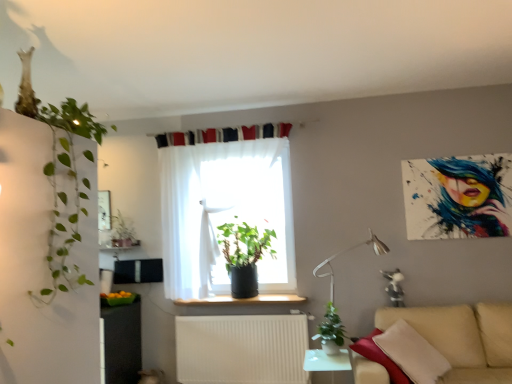
Question: Is green matte plant at lower center, which appears as the 2th houseplant when viewed from the front, inside or outside of white glossy table at lower center?

Choices:
 (A) outside
 (B) inside

Answer: (A)

Question: Looking at their shapes, would you say green matte plant at lower center, the 4th houseplant positioned from the left, is wider or thinner than white glossy table at lower center?

Choices:
 (A) wide
 (B) thin

Answer: (B)

Question: Considering the real-world distances, which object is farthest from the white glossy table at lower center?

Choices:
 (A) beige fabric couch at lower right
 (B) black plastic window sill at center
 (C) white matte radiator at lower center
 (D) green matte plant at lower center, the 4th houseplant positioned from the left
 (E) green leafy plant at left, which is the first houseplant in front-to-back order

Answer: (E)

Question: Which object is the farthest from the white glossy table at lower center?

Choices:
 (A) green matte plant at lower center, which appears as the 2th houseplant when viewed from the front
 (B) black plastic window sill at center
 (C) metallic silver table lamp at lower right
 (D) green matte plant at upper left, which is the 1th houseplant from back to front
 (E) green leafy plant at left, acting as the third houseplant starting from the right

Answer: (E)